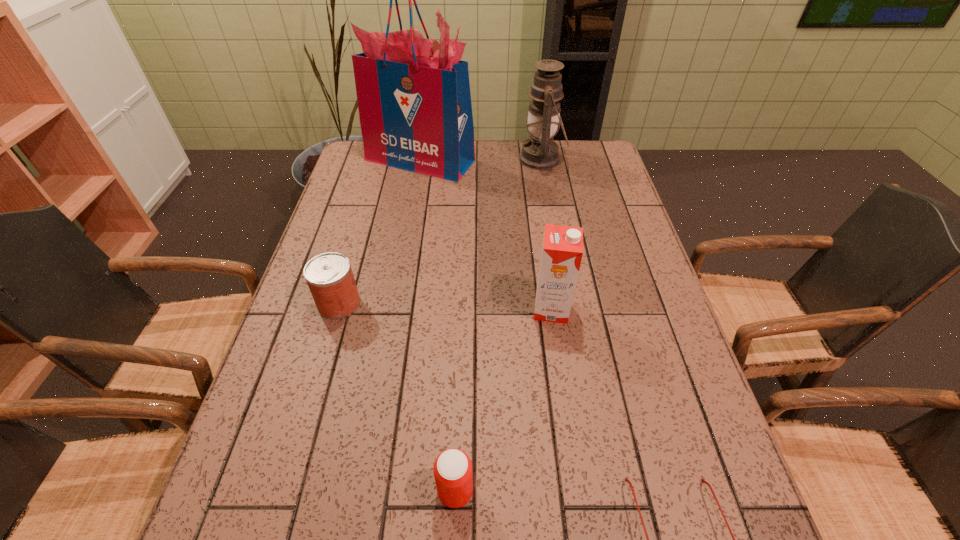
Find the location of a particular element. grocery bag positioned at the far edge is located at coordinates (414, 101).

The height and width of the screenshot is (540, 960). I want to click on oil lamp at the far edge, so click(540, 152).

Locate an element on the screen. The image size is (960, 540). grocery bag positioned at the left edge is located at coordinates (414, 101).

Locate an element on the screen. can positioned at the left edge is located at coordinates (329, 276).

The image size is (960, 540). What are the coordinates of `object that is at the right edge` in the screenshot? It's located at (540, 152).

What are the coordinates of `object that is at the far left corner` in the screenshot? It's located at (414, 101).

The width and height of the screenshot is (960, 540). I want to click on object at the far right corner, so click(540, 152).

What are the coordinates of `vacant space at the far edge of the desktop` in the screenshot? It's located at (486, 176).

Where is `free space at the left edge of the desktop`? This screenshot has height=540, width=960. free space at the left edge of the desktop is located at coordinates (312, 257).

This screenshot has height=540, width=960. In the image, there is a desktop. In order to click on vacant space at the right edge in this screenshot , I will do `click(674, 507)`.